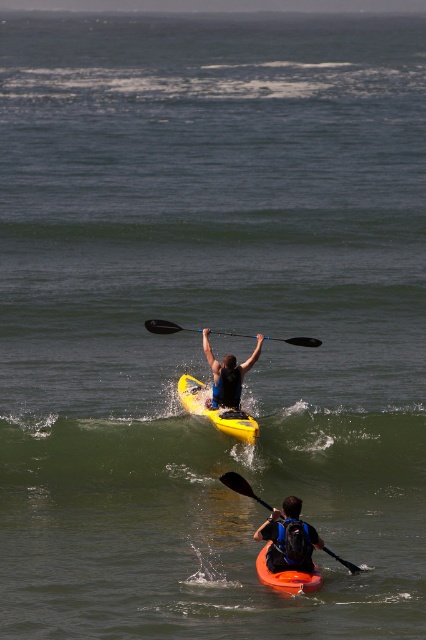
Between point (180, 380) and point (262, 502), which one is positioned in front?

Point (262, 502)

Can you confirm if yellow matte kayak at center is thinner than black plastic paddle at lower center?

No, yellow matte kayak at center is not thinner than black plastic paddle at lower center.

Does point (236, 428) come in front of point (238, 483)?

No, (236, 428) is behind (238, 483).

The height and width of the screenshot is (640, 426). In order to click on yellow matte kayak at center in this screenshot , I will do `click(215, 410)`.

Does point (305, 420) come farther from viewer compared to point (232, 476)?

Yes, point (305, 420) is behind point (232, 476).

At what (x,y) coordinates should I click in order to perform the action: click on green rubber wave at center. Please return your answer as a coordinate pair (x, y). Looking at the image, I should click on (215, 456).

I want to click on green rubber wave at center, so click(215, 456).

Between point (385, 433) and point (186, 408), which one is positioned in front?

Positioned in front is point (186, 408).

Is green rubber wave at center to the right of yellow matte kayak at center from the viewer's perspective?

In fact, green rubber wave at center is to the left of yellow matte kayak at center.

Is point (103, 429) behind point (192, 376)?

No, it is in front of (192, 376).

Where is `green rubber wave at center`? Image resolution: width=426 pixels, height=640 pixels. green rubber wave at center is located at coordinates (215, 456).